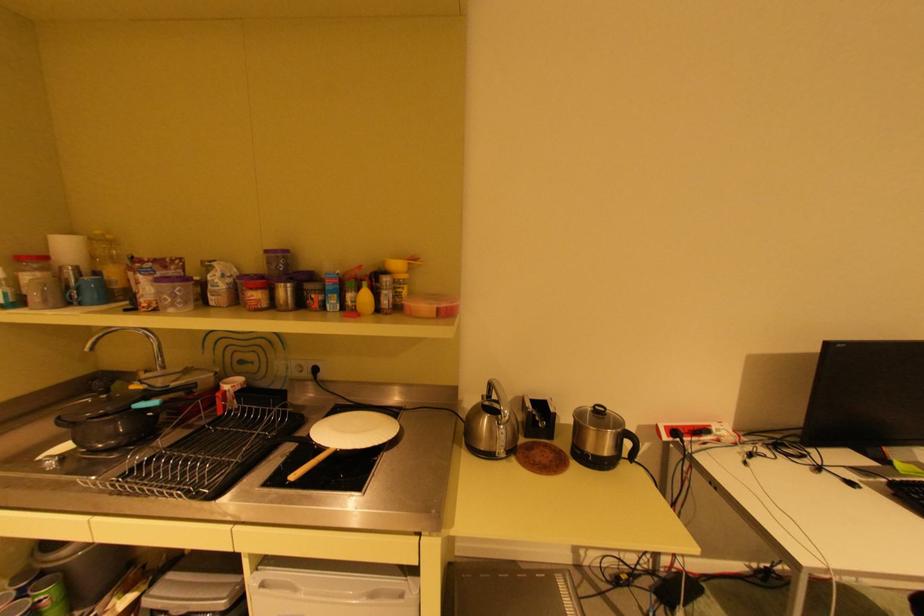
Where would you lift the pitcher? Please return your answer as a coordinate pair (x, y).

(601, 438)